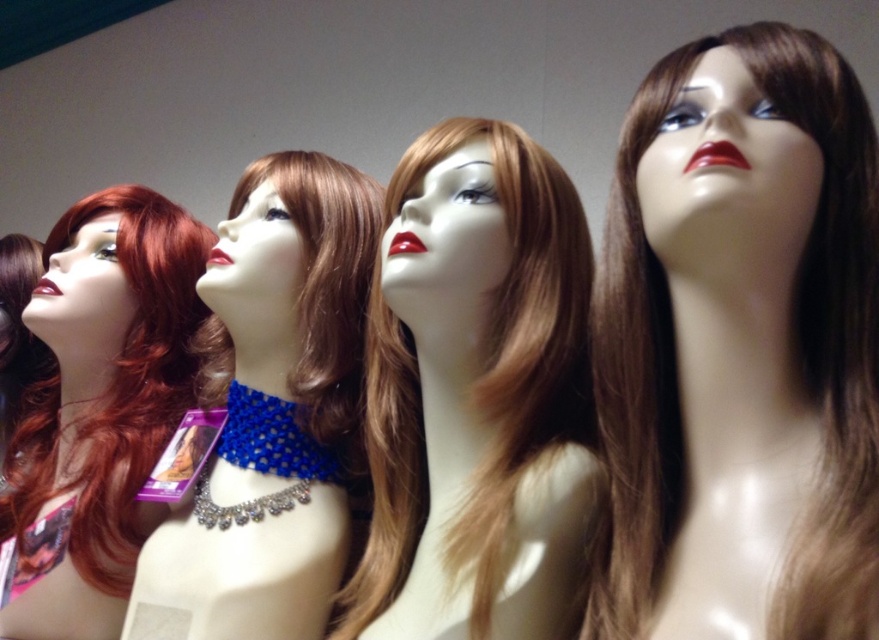
You are a stylist trying to choose between two wigs displayed in the image. The first is the brown shiny wig at center and the second is the shiny brown wig at center. Which wig is placed higher on the mannequin?

The brown shiny wig at center is positioned over the shiny brown wig at center, so it is placed higher.

You are a stylist trying to choose between the brown shiny wig at center and the shiny brown wig at center for a client with a round face. Which wig would you recommend based on their thickness?

The brown shiny wig at center is thinner than the shiny brown wig at center. For a round face, a thinner wig might be more flattering to create a slimming effect.